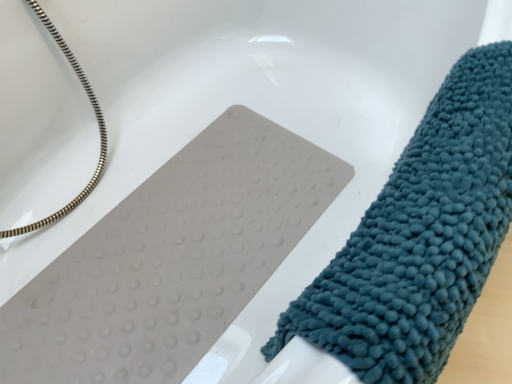
Question: In the image, is teal textured towel at right positioned in front of or behind silver metallic hose at upper left?

Choices:
 (A) front
 (B) behind

Answer: (A)

Question: From a real-world perspective, is teal textured towel at right above or below silver metallic hose at upper left?

Choices:
 (A) below
 (B) above

Answer: (B)

Question: Is teal textured towel at right to the left or to the right of silver metallic hose at upper left in the image?

Choices:
 (A) right
 (B) left

Answer: (A)

Question: Is silver metallic hose at upper left situated inside teal textured towel at right or outside?

Choices:
 (A) inside
 (B) outside

Answer: (B)

Question: In terms of size, does silver metallic hose at upper left appear bigger or smaller than teal textured towel at right?

Choices:
 (A) big
 (B) small

Answer: (A)

Question: Is silver metallic hose at upper left wider or thinner than teal textured towel at right?

Choices:
 (A) thin
 (B) wide

Answer: (B)

Question: Considering the positions of silver metallic hose at upper left and teal textured towel at right in the image, is silver metallic hose at upper left taller or shorter than teal textured towel at right?

Choices:
 (A) tall
 (B) short

Answer: (A)